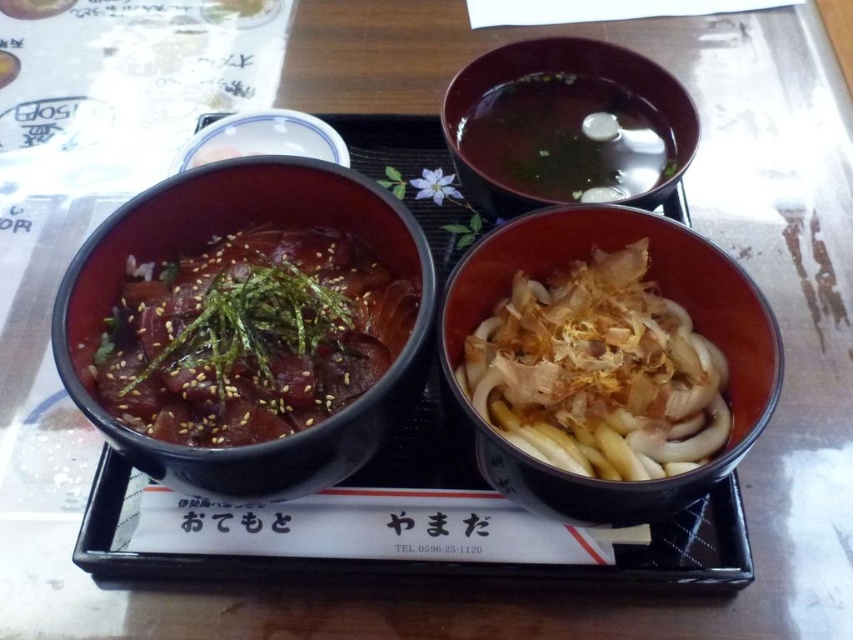
Is matte black bowl at left below matte ceramic bowl at upper center?

Yes.

Is matte black bowl at left taller than matte ceramic bowl at upper center?

Correct, matte black bowl at left is much taller as matte ceramic bowl at upper center.

Where is `matte black bowl at left`? The width and height of the screenshot is (853, 640). matte black bowl at left is located at coordinates (202, 243).

Can you confirm if matte brown bowl at center is positioned above brown glossy bowl at upper center?

Actually, matte brown bowl at center is below brown glossy bowl at upper center.

Can you confirm if matte brown bowl at center is taller than brown glossy bowl at upper center?

Yes, matte brown bowl at center is taller than brown glossy bowl at upper center.

Between point (573, 518) and point (595, 52), which one is positioned in front?

Point (573, 518) is more forward.

You are a GUI agent. You are given a task and a screenshot of the screen. Output one action in this format:
    pyautogui.click(x=<x>, y=<y>)
    Task: Click on the matte brown bowl at center
    The width and height of the screenshot is (853, 640).
    Given the screenshot: What is the action you would take?
    pyautogui.click(x=662, y=294)

Which of these two, matte black bowl at left or brown glossy bowl at upper center, stands shorter?

brown glossy bowl at upper center is shorter.

Can you confirm if matte black bowl at left is shorter than brown glossy bowl at upper center?

No, matte black bowl at left is not shorter than brown glossy bowl at upper center.

Who is more distant from viewer, (274, 445) or (526, 68)?

The point (526, 68) is more distant.

Where is `matte black bowl at left`? Image resolution: width=853 pixels, height=640 pixels. matte black bowl at left is located at coordinates (202, 243).